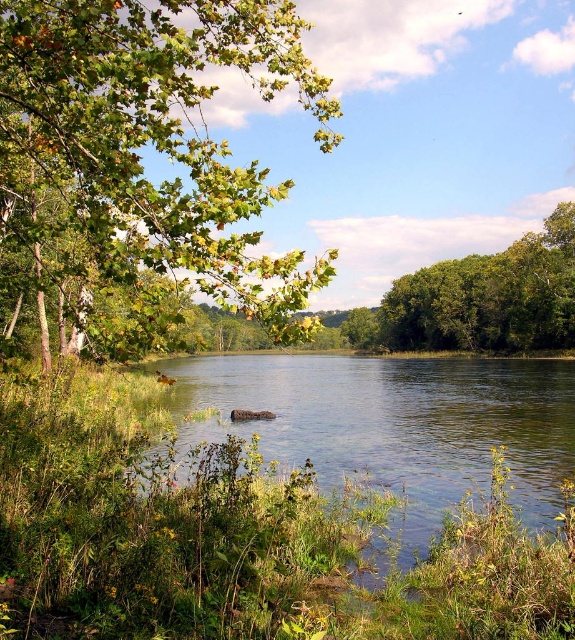
You are standing at the edge of the water in the serene natural landscape. There are two points marked in the image, point 1 at coordinates point (52,65) and point 2 at coordinates point (276,403). Which point is closer to you?

Point (52,65) is in front of point (276,403), so it is closer to you.

You are standing at the edge of the green grassy river at center and want to reach the green leafy tree at right. Which direction should you walk to get closer to the tree?

Since the green grassy river at center has a lesser height compared to the green leafy tree at right, you should walk towards the right direction to get closer to the green leafy tree at right.

You are standing at the edge of the green grassy river at center and want to reach the green leafy branch at upper left. Which direction should you move to get closer to the branch?

You should move to the left side to get closer to the green leafy branch at upper left since it is positioned on the left side of the green grassy river at center.